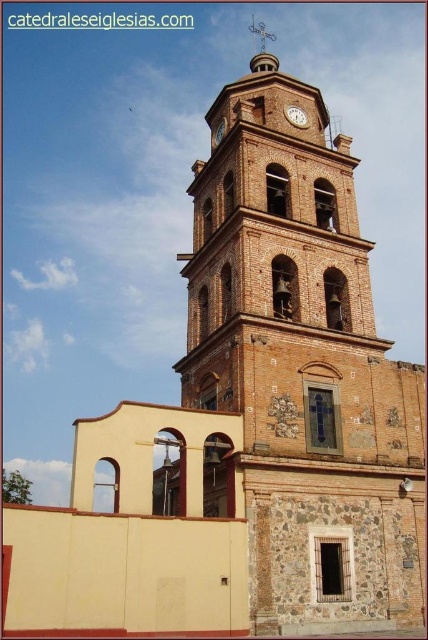
Is point (264, 26) farther from viewer compared to point (223, 129)?

Yes, it is.

Is polished copper cross at center top below matte brown clock at center?

Incorrect, polished copper cross at center top is not positioned below matte brown clock at center.

At what (x,y) coordinates should I click in order to perform the action: click on polished copper cross at center top. Please return your answer as a coordinate pair (x, y). This screenshot has height=640, width=428. Looking at the image, I should click on 262,49.

Is polished copper cross at center top taller than matte brown clock at upper center?

Correct, polished copper cross at center top is much taller as matte brown clock at upper center.

Is point (264, 42) positioned after point (305, 116)?

Yes, it is.

The image size is (428, 640). I want to click on polished copper cross at center top, so click(262, 49).

Can you confirm if matte brown clock at upper center is shorter than matte brown clock at center?

Yes.

Who is positioned more to the right, matte brown clock at upper center or matte brown clock at center?

matte brown clock at upper center is more to the right.

Who is more distant from viewer, (294, 125) or (222, 132)?

Answer: The point (222, 132) is behind.

Identify the location of matte brown clock at upper center. This screenshot has height=640, width=428. (296, 115).